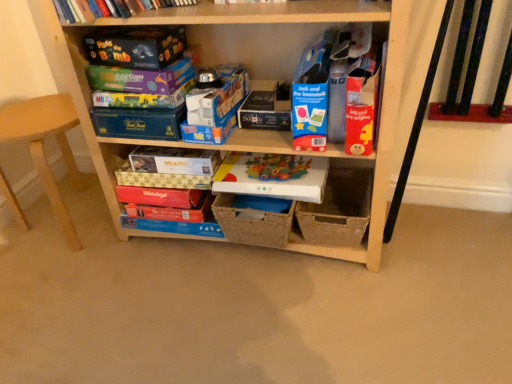
Question: Can you confirm if matt black game box at upper left, positioned as the 1th paperback book in top-to-bottom order, is wider than matte plastic board game at center, which is the 2th paperback book from bottom to top?

Choices:
 (A) yes
 (B) no

Answer: (B)

Question: Can you confirm if matt black game box at upper left, placed as the seventh paperback book when sorted from bottom to top, is taller than matte plastic board game at center, positioned as the sixth paperback book in top-to-bottom order?

Choices:
 (A) yes
 (B) no

Answer: (A)

Question: Can you confirm if matt black game box at upper left, positioned as the 1th paperback book in top-to-bottom order, is positioned to the right of matte plastic board game at center, positioned as the sixth paperback book in top-to-bottom order?

Choices:
 (A) no
 (B) yes

Answer: (A)

Question: Is matt black game box at upper left, positioned as the 1th paperback book in top-to-bottom order, positioned before matte plastic board game at center, positioned as the sixth paperback book in top-to-bottom order?

Choices:
 (A) no
 (B) yes

Answer: (B)

Question: Is matt black game box at upper left, positioned as the 1th paperback book in top-to-bottom order, behind matte plastic board game at center, positioned as the sixth paperback book in top-to-bottom order?

Choices:
 (A) no
 (B) yes

Answer: (A)

Question: Considering the relative sizes of matt black game box at upper left, positioned as the 1th paperback book in top-to-bottom order, and matte plastic board game at center, which is the 2th paperback book from bottom to top, in the image provided, is matt black game box at upper left, positioned as the 1th paperback book in top-to-bottom order, bigger than matte plastic board game at center, which is the 2th paperback book from bottom to top,?

Choices:
 (A) no
 (B) yes

Answer: (A)

Question: Would you consider blue cardboard box at center, placed as the 2th storage box when sorted from top to bottom, to be distant from natural woven basket at center, which is the 1th storage box from bottom to top?

Choices:
 (A) no
 (B) yes

Answer: (A)

Question: Is blue cardboard box at center, placed as the 2th storage box when sorted from top to bottom, shorter than natural woven basket at center, which is the 3th storage box in top-to-bottom order?

Choices:
 (A) no
 (B) yes

Answer: (B)

Question: Can you confirm if blue cardboard box at center, placed as the 2th storage box when sorted from top to bottom, is thinner than natural woven basket at center, which is the 1th storage box from bottom to top?

Choices:
 (A) no
 (B) yes

Answer: (B)

Question: From the image's perspective, is blue cardboard box at center, which is the 2th storage box in bottom-to-top order, located beneath natural woven basket at center, which is the 3th storage box in top-to-bottom order?

Choices:
 (A) no
 (B) yes

Answer: (A)

Question: Is blue cardboard box at center, placed as the 2th storage box when sorted from top to bottom, positioned behind natural woven basket at center, which is the 1th storage box from bottom to top?

Choices:
 (A) yes
 (B) no

Answer: (B)

Question: Would you say blue cardboard box at center, which is the 2th storage box in bottom-to-top order, is outside natural woven basket at center, which is the 1th storage box from bottom to top?

Choices:
 (A) yes
 (B) no

Answer: (A)

Question: From a real-world perspective, is matte plastic board game at center, which is the 2th paperback book from bottom to top, physically below matte gold paperback book at center, arranged as the 5th paperback book when viewed from the top?

Choices:
 (A) no
 (B) yes

Answer: (A)